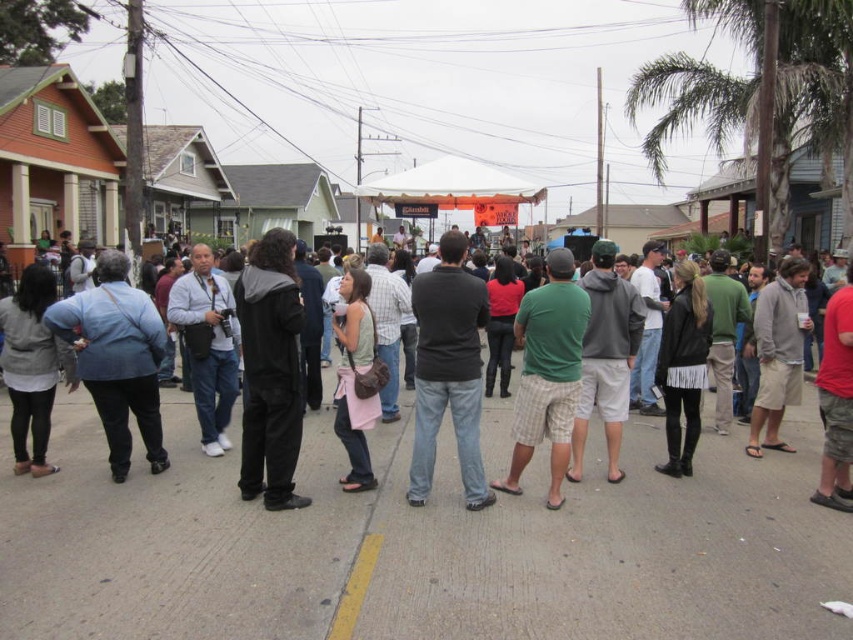
You are standing at the edge of the crowd in the residential street scene. There are two points marked in the image, one at coordinates point (137, 358) and another at point (45, 346). Which point is physically closer to you?

Point (137, 358) is closer to the viewer than point (45, 346).

Consider the image. You are standing at the center of the street, looking towards the crowd. Where exactly is the green plaid shorts at center located in relation to your position?

The green plaid shorts at center is located at point 0.583 on the x axis and 0.642 on the y axis relative to your position.

You are a photographer standing at the edge of the crowd. You want to capture a photo that includes both the black matte jumpsuit at center and the green plaid shorts at center. Given that your camera has a maximum focus range of 2 meters, will you be able to capture both subjects in focus without moving closer or further away?

The distance between the black matte jumpsuit at center and the green plaid shorts at center is 1.95 meters, which is within the camera maximum focus range of 2 meters. Therefore, you can capture both subjects in focus without adjusting your position.